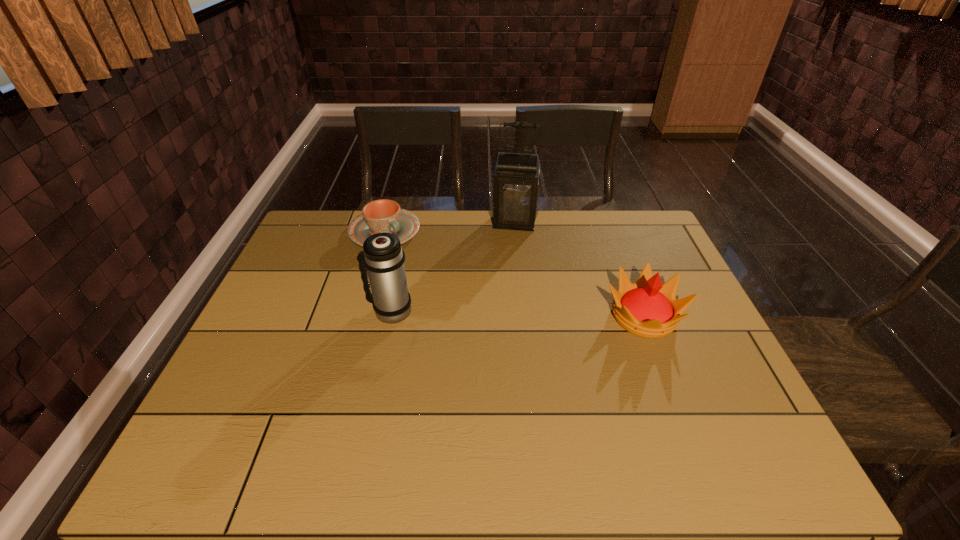
Locate an element on the screen. Image resolution: width=960 pixels, height=540 pixels. free spot on the desktop that is between the thermos bottle and the rightmost object and is positioned on the front-facing side of the lantern is located at coordinates (503, 313).

At what (x,y) coordinates should I click in order to perform the action: click on free space on the desktop that is between the thermos bottle and the rightmost object and is positioned on the handle side of the shortest object. Please return your answer as a coordinate pair (x, y). The image size is (960, 540). Looking at the image, I should click on (486, 313).